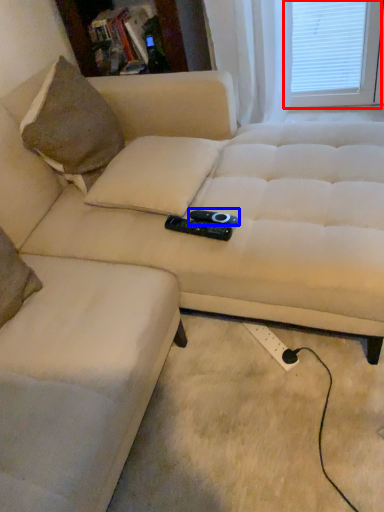
Question: Which of the following is the farthest to the observer, window screen (highlighted by a red box) or remote (highlighted by a blue box)?

Choices:
 (A) window screen
 (B) remote

Answer: (A)